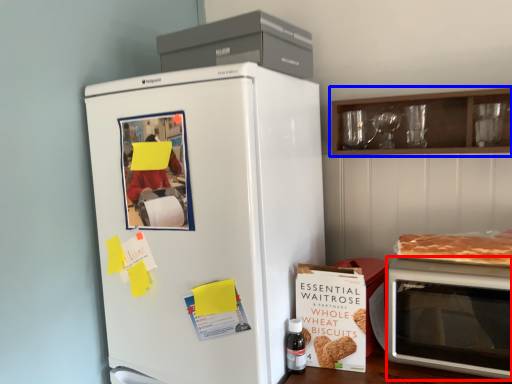
Question: Which object is closer to the camera taking this photo, microwave oven (highlighted by a red box) or cabinetry (highlighted by a blue box)?

Choices:
 (A) microwave oven
 (B) cabinetry

Answer: (A)